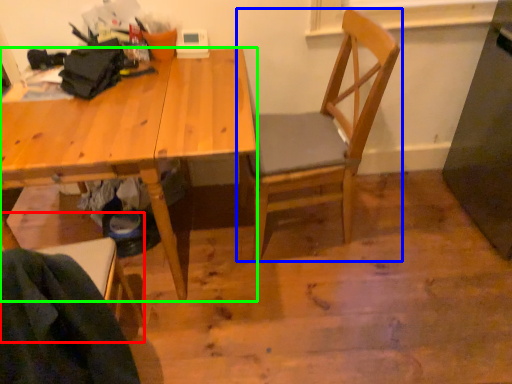
Question: Considering the real-world distances, which object is farthest from chair (highlighted by a red box)? chair (highlighted by a blue box) or desk (highlighted by a green box)?

Choices:
 (A) chair
 (B) desk

Answer: (A)